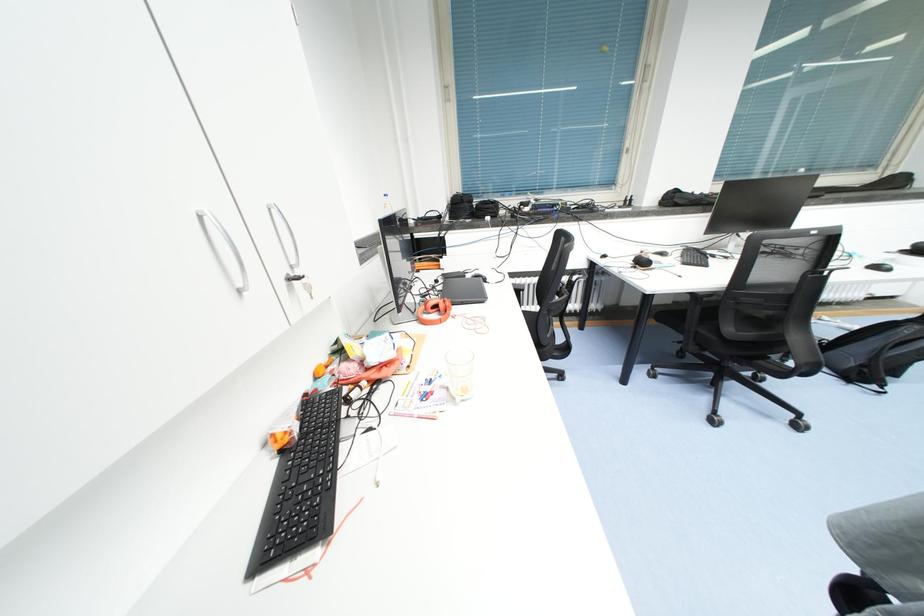
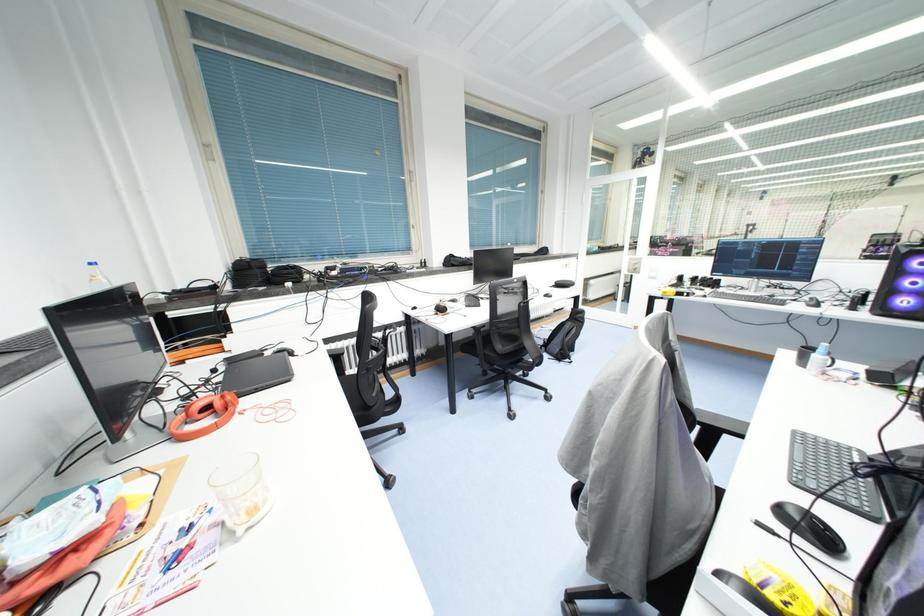
Question: The images are taken continuously from a first-person perspective. In which direction is your viewpoint rotating?

Choices:
 (A) Left
 (B) Right
 (C) Up
 (D) Down

Answer: (B)